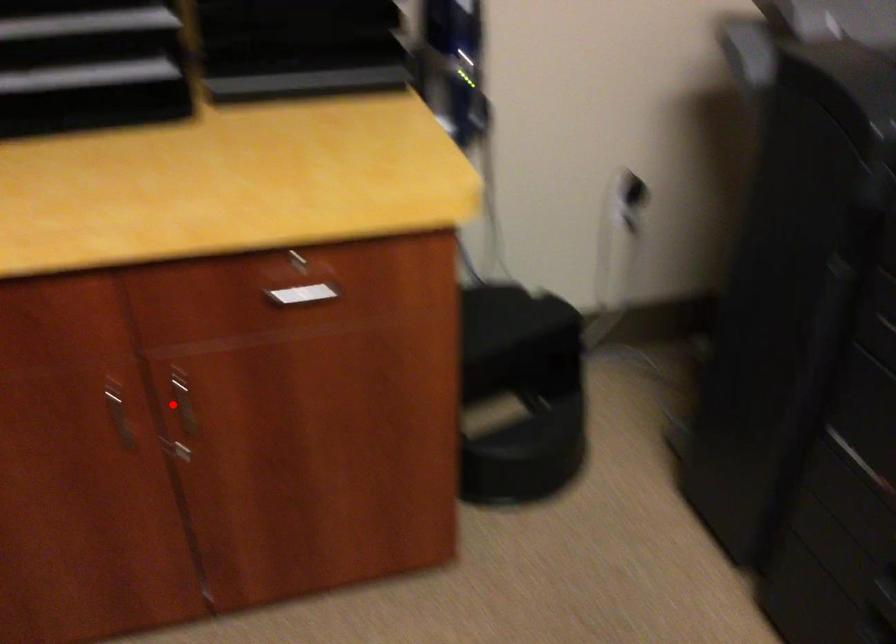
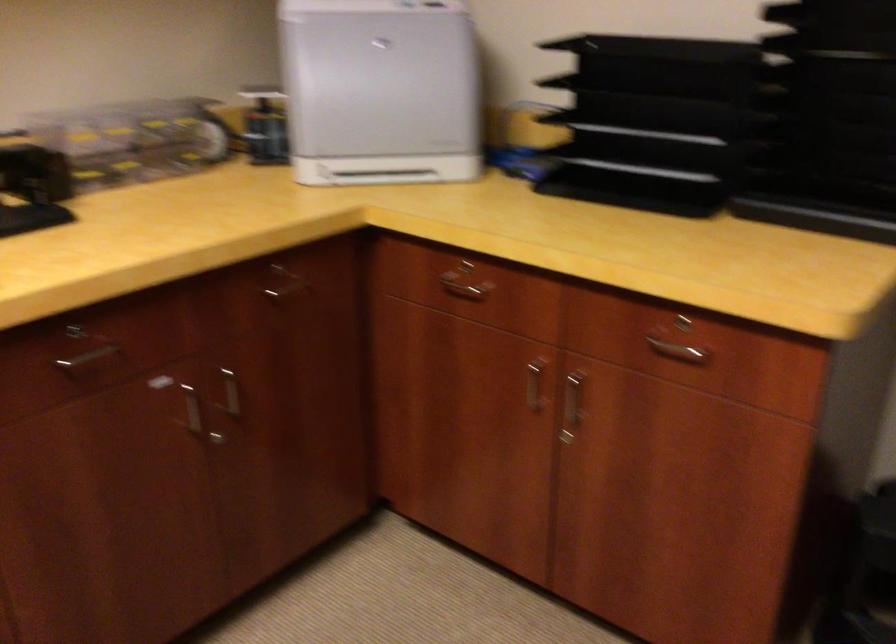
In the second image, find the point that corresponds to the highlighted location in the first image.

(572, 401)